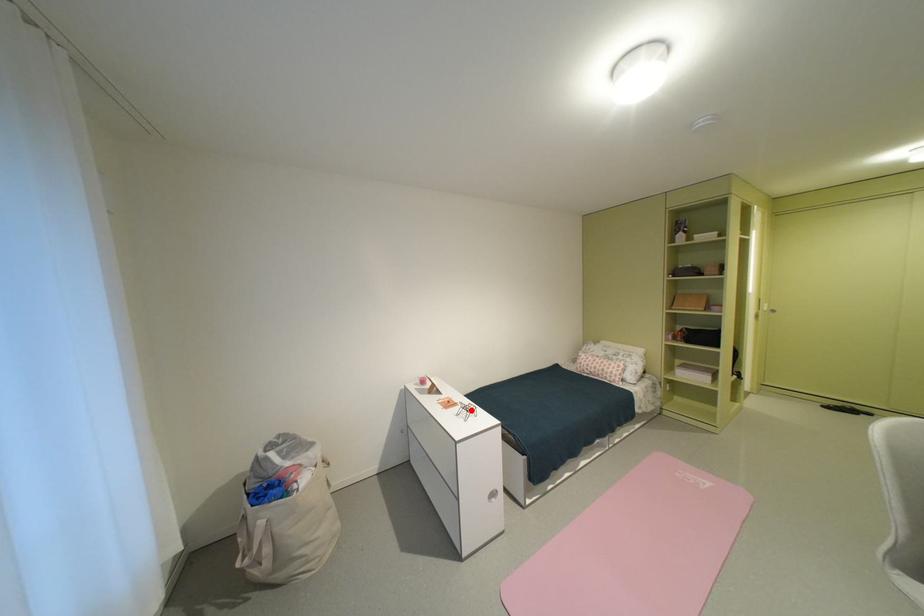
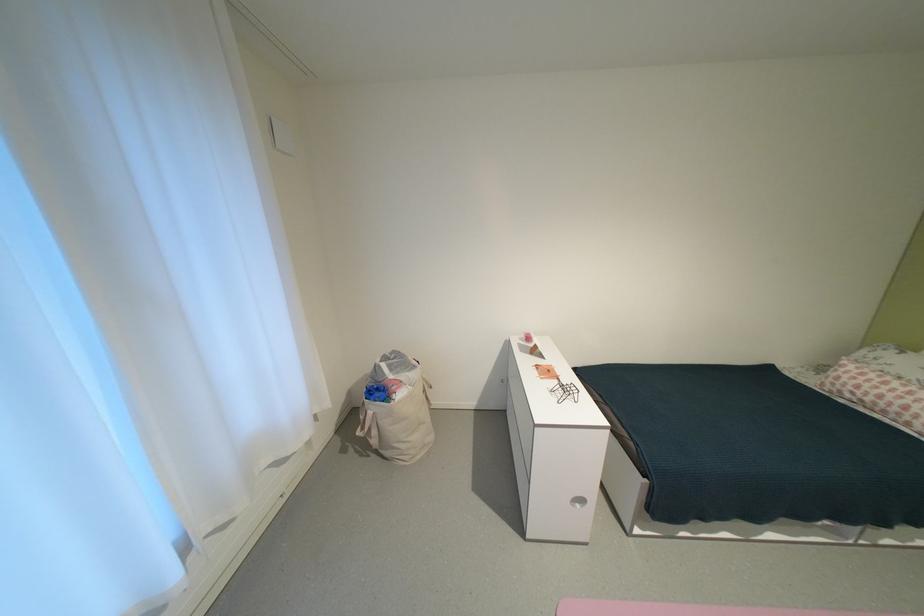
Question: I am providing you with two images of the same scene from different viewpoints. Image1 has a red point marked. In image2, the corresponding 3D location appears at what relative position? Reply with the corresponding letter.

Choices:
 (A) Closer
 (B) Farther

Answer: (B)